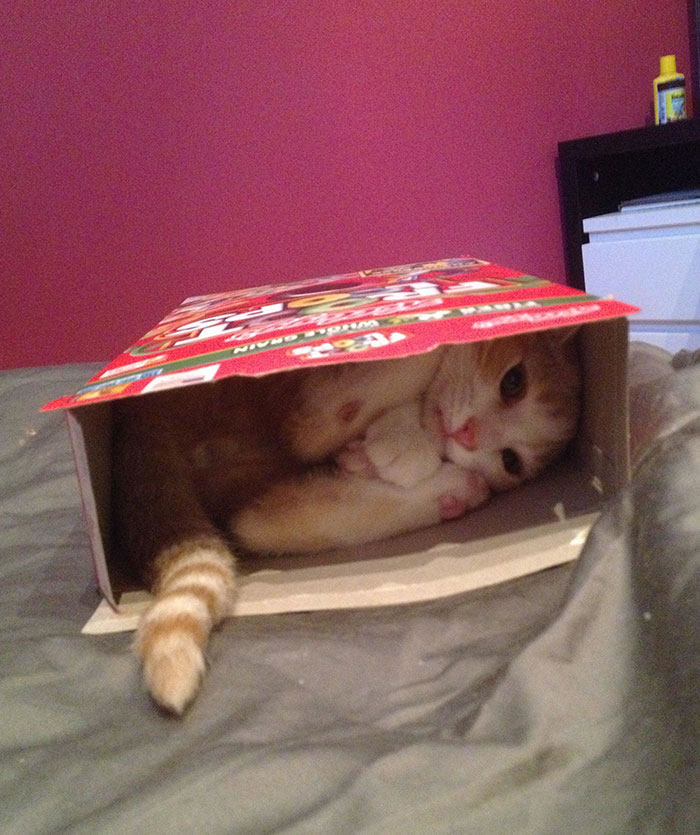
The width and height of the screenshot is (700, 835). I want to click on box, so click(490, 296).